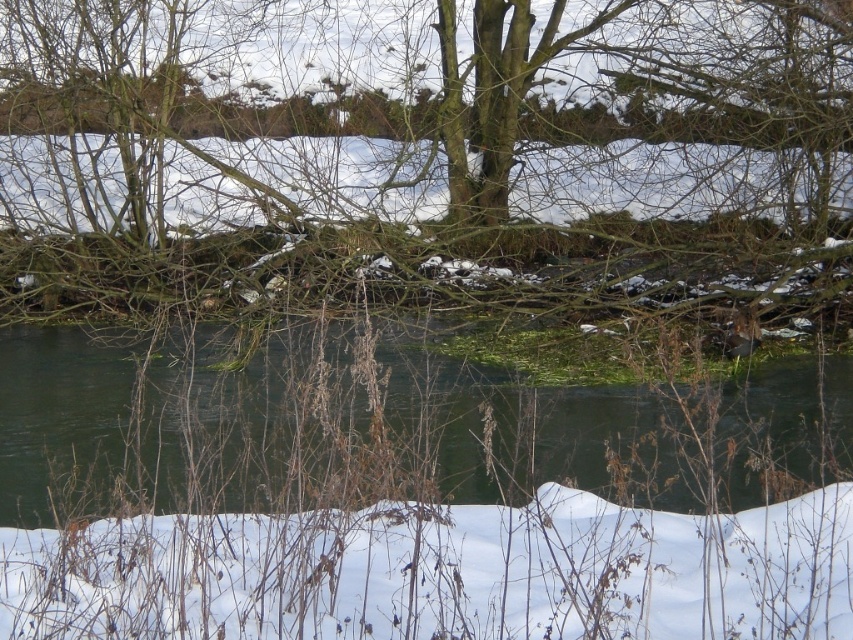
Question: Which of the following is the farthest from the observer?

Choices:
 (A) (126, 456)
 (B) (572, 136)

Answer: (B)

Question: In this image, where is green algae at center located relative to white fluffy snow at lower center?

Choices:
 (A) left
 (B) right

Answer: (B)

Question: Which point is farther to the camera?

Choices:
 (A) green algae at center
 (B) brown bark tree at center

Answer: (B)

Question: Does brown bark tree at center have a smaller size compared to green algae at center?

Choices:
 (A) yes
 (B) no

Answer: (B)

Question: Among these points, which one is nearest to the camera?

Choices:
 (A) pyautogui.click(x=814, y=374)
 (B) pyautogui.click(x=653, y=563)
 (C) pyautogui.click(x=450, y=76)

Answer: (B)

Question: From the image, what is the correct spatial relationship of brown bark tree at center in relation to green algae at center?

Choices:
 (A) below
 (B) above

Answer: (B)